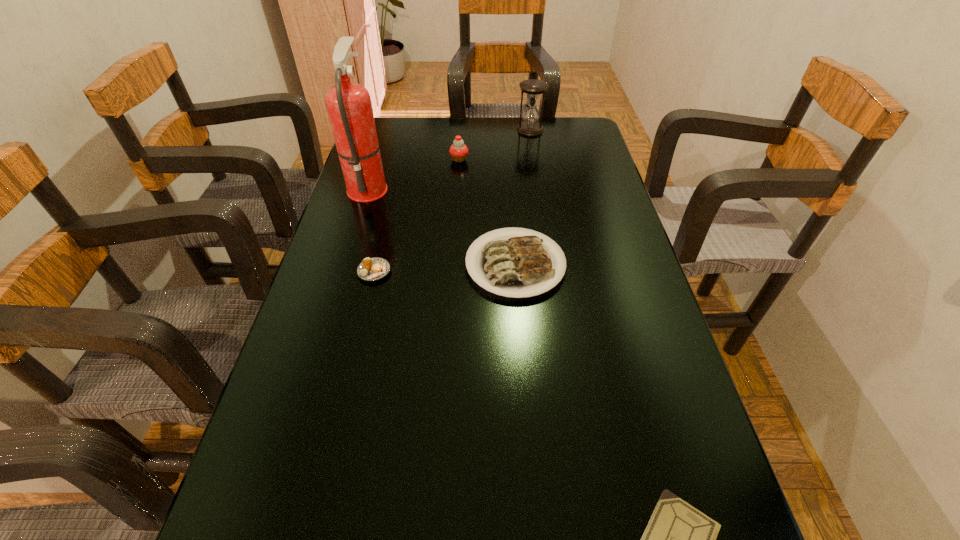
Locate an element on the screen. This screenshot has width=960, height=540. free space that is in between the fire extinguisher and the fourth shortest object is located at coordinates (414, 173).

Where is `unoccupied area between the fifth tallest object and the fire extinguisher`? unoccupied area between the fifth tallest object and the fire extinguisher is located at coordinates (372, 230).

Find the location of a particular element. This screenshot has width=960, height=540. free space between the fourth tallest object and the cupcake is located at coordinates (487, 212).

This screenshot has height=540, width=960. Find the location of `free space that is in between the plate and the third farthest object`. free space that is in between the plate and the third farthest object is located at coordinates (442, 226).

Image resolution: width=960 pixels, height=540 pixels. What are the coordinates of `free space between the pastry and the cupcake` in the screenshot? It's located at (417, 215).

The height and width of the screenshot is (540, 960). Identify the location of free space between the fifth tallest object and the fourth tallest object. (444, 268).

Where is `empty space that is in between the third tallest object and the second tallest object`? empty space that is in between the third tallest object and the second tallest object is located at coordinates (494, 145).

The width and height of the screenshot is (960, 540). I want to click on object that is the closest to the second tallest object, so click(458, 151).

Identify which object is the second closest to the hourglass. Please provide its 2D coordinates. Your answer should be formatted as a tuple, i.e. [(x, y)], where the tuple contains the x and y coordinates of a point satisfying the conditions above.

[(349, 107)]

You are a GUI agent. You are given a task and a screenshot of the screen. Output one action in this format:
    pyautogui.click(x=<x>, y=<y>)
    Task: Click on the vacant point that satisfies the following two spatial constraints: 1. with the handle and hose on the tallest object; 2. on the right side of the pastry
    The width and height of the screenshot is (960, 540).
    Given the screenshot: What is the action you would take?
    pyautogui.click(x=343, y=272)